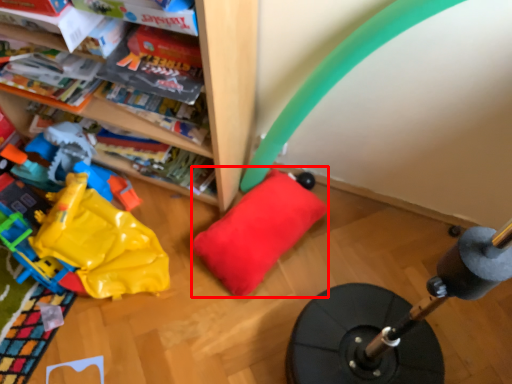
Question: Observing the image, what is the correct spatial positioning of pillow (annotated by the red box) in reference to toy?

Choices:
 (A) left
 (B) right

Answer: (B)